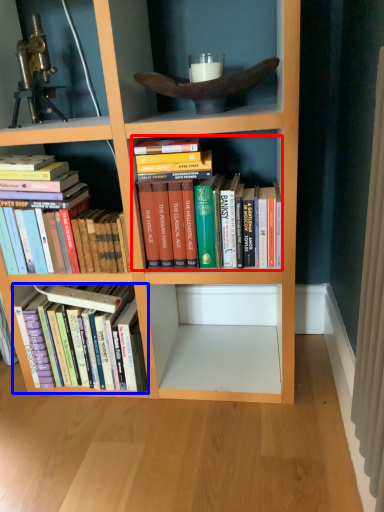
Question: Which object appears closest to the camera in this image, book (highlighted by a red box) or book (highlighted by a blue box)?

Choices:
 (A) book
 (B) book

Answer: (A)